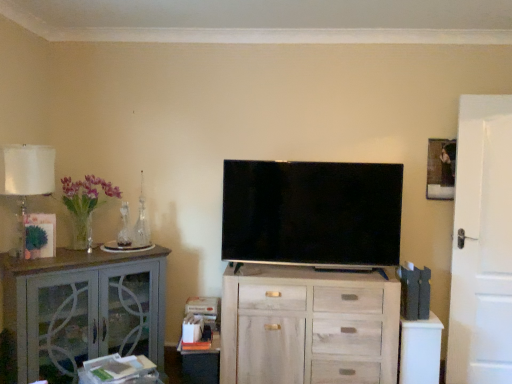
Question: From the image's perspective, is white wood chest of drawers at center under translucent glass vase at left?

Choices:
 (A) yes
 (B) no

Answer: (A)

Question: Can you confirm if white wood chest of drawers at center is bigger than translucent glass vase at left?

Choices:
 (A) no
 (B) yes

Answer: (B)

Question: Is white wood chest of drawers at center positioned before translucent glass vase at left?

Choices:
 (A) no
 (B) yes

Answer: (A)

Question: Does white wood chest of drawers at center have a lesser height compared to translucent glass vase at left?

Choices:
 (A) no
 (B) yes

Answer: (A)

Question: From a real-world perspective, does white wood chest of drawers at center sit lower than translucent glass vase at left?

Choices:
 (A) yes
 (B) no

Answer: (A)

Question: Is white wood chest of drawers at center outside of translucent glass vase at left?

Choices:
 (A) no
 (B) yes

Answer: (B)

Question: Would you say clear glass vase at left is outside white matte door at right?

Choices:
 (A) no
 (B) yes

Answer: (B)

Question: Considering the relative positions of clear glass vase at left and white matte door at right in the image provided, is clear glass vase at left to the left of white matte door at right from the viewer's perspective?

Choices:
 (A) no
 (B) yes

Answer: (B)

Question: Considering the relative sizes of clear glass vase at left and white matte door at right in the image provided, is clear glass vase at left thinner than white matte door at right?

Choices:
 (A) no
 (B) yes

Answer: (A)

Question: From the image's perspective, is clear glass vase at left located beneath white matte door at right?

Choices:
 (A) no
 (B) yes

Answer: (A)

Question: From a real-world perspective, is clear glass vase at left on top of white matte door at right?

Choices:
 (A) no
 (B) yes

Answer: (B)

Question: Is clear glass vase at left next to white matte door at right and touching it?

Choices:
 (A) no
 (B) yes

Answer: (A)

Question: Does translucent glass table lamp at left appear on the right side of translucent glass vase at left?

Choices:
 (A) yes
 (B) no

Answer: (B)